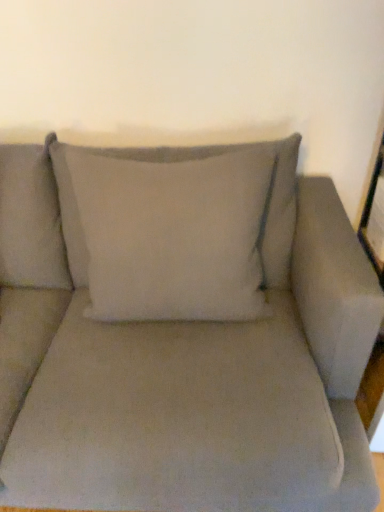
Question: Is white cotton pillow at center to the right of matte gray couch at center from the viewer's perspective?

Choices:
 (A) yes
 (B) no

Answer: (A)

Question: From a real-world perspective, does white cotton pillow at center sit lower than matte gray couch at center?

Choices:
 (A) no
 (B) yes

Answer: (A)

Question: Considering the relative sizes of white cotton pillow at center and matte gray couch at center in the image provided, is white cotton pillow at center smaller than matte gray couch at center?

Choices:
 (A) no
 (B) yes

Answer: (B)

Question: Considering the relative sizes of white cotton pillow at center and matte gray couch at center in the image provided, is white cotton pillow at center wider than matte gray couch at center?

Choices:
 (A) yes
 (B) no

Answer: (B)

Question: Considering the relative sizes of white cotton pillow at center and matte gray couch at center in the image provided, is white cotton pillow at center shorter than matte gray couch at center?

Choices:
 (A) no
 (B) yes

Answer: (B)

Question: Is the surface of white cotton pillow at center in direct contact with matte gray couch at center?

Choices:
 (A) yes
 (B) no

Answer: (B)

Question: Considering the relative sizes of matte gray couch at center and white cotton pillow at center in the image provided, is matte gray couch at center smaller than white cotton pillow at center?

Choices:
 (A) yes
 (B) no

Answer: (B)

Question: Is matte gray couch at center bigger than white cotton pillow at center?

Choices:
 (A) no
 (B) yes

Answer: (B)

Question: From the image's perspective, is matte gray couch at center located above white cotton pillow at center?

Choices:
 (A) no
 (B) yes

Answer: (A)

Question: Is white cotton pillow at center a part of matte gray couch at center?

Choices:
 (A) no
 (B) yes

Answer: (B)

Question: Does matte gray couch at center appear on the left side of white cotton pillow at center?

Choices:
 (A) no
 (B) yes

Answer: (B)

Question: From the image's perspective, is matte gray couch at center located beneath white cotton pillow at center?

Choices:
 (A) yes
 (B) no

Answer: (A)

Question: Relative to white cotton pillow at center, is matte gray couch at center in front or behind?

Choices:
 (A) front
 (B) behind

Answer: (A)